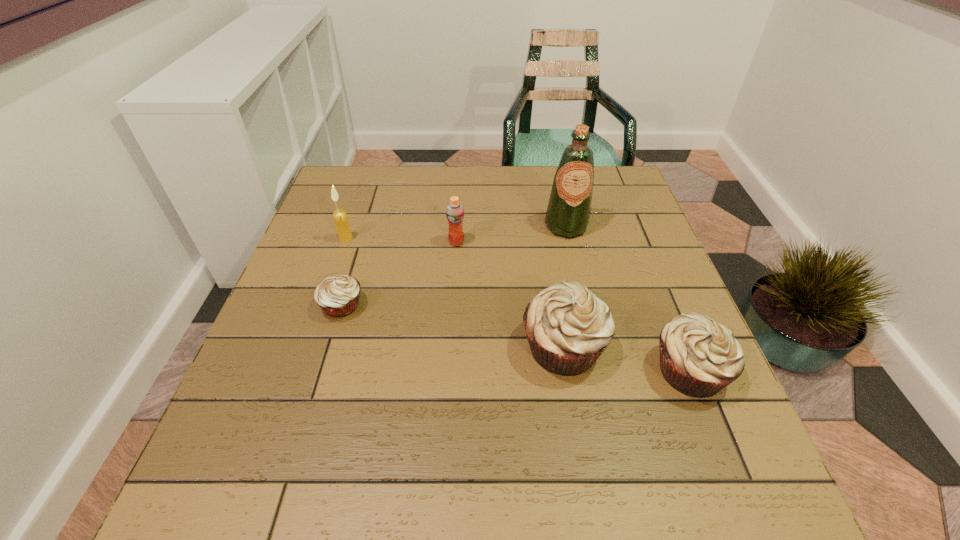
Where is `free spot between the candle and the leftmost muffin`? Image resolution: width=960 pixels, height=540 pixels. free spot between the candle and the leftmost muffin is located at coordinates (344, 272).

Find the location of a particular element. free space between the tallest object and the fourth object from right to left is located at coordinates click(512, 234).

Where is `vacant space in between the second muffin from left to right and the orange juice`? The image size is (960, 540). vacant space in between the second muffin from left to right and the orange juice is located at coordinates (510, 294).

Locate an element on the screen. unoccupied area between the third object from left to right and the second muffin from left to right is located at coordinates click(x=510, y=294).

Identify the location of free space between the second muffin from right to left and the orange juice. This screenshot has width=960, height=540. (510, 294).

Find the location of a particular element. unoccupied position between the rightmost object and the fifth shortest object is located at coordinates (517, 305).

Locate an element on the screen. object that is the fourth closest one to the second tallest object is located at coordinates (568, 212).

Locate which object ranks fifth in proximity to the rightmost object. Please provide its 2D coordinates. Your answer should be formatted as a tuple, i.e. [(x, y)], where the tuple contains the x and y coordinates of a point satisfying the conditions above.

[(340, 217)]

You are a GUI agent. You are given a task and a screenshot of the screen. Output one action in this format:
    pyautogui.click(x=<x>, y=<y>)
    Task: Click on the muffin that stands as the second closest to the orange juice
    Image resolution: width=960 pixels, height=540 pixels.
    Given the screenshot: What is the action you would take?
    pyautogui.click(x=568, y=328)

Locate which muffin is the closest to the second muffin from left to right. Please provide its 2D coordinates. Your answer should be formatted as a tuple, i.e. [(x, y)], where the tuple contains the x and y coordinates of a point satisfying the conditions above.

[(698, 357)]